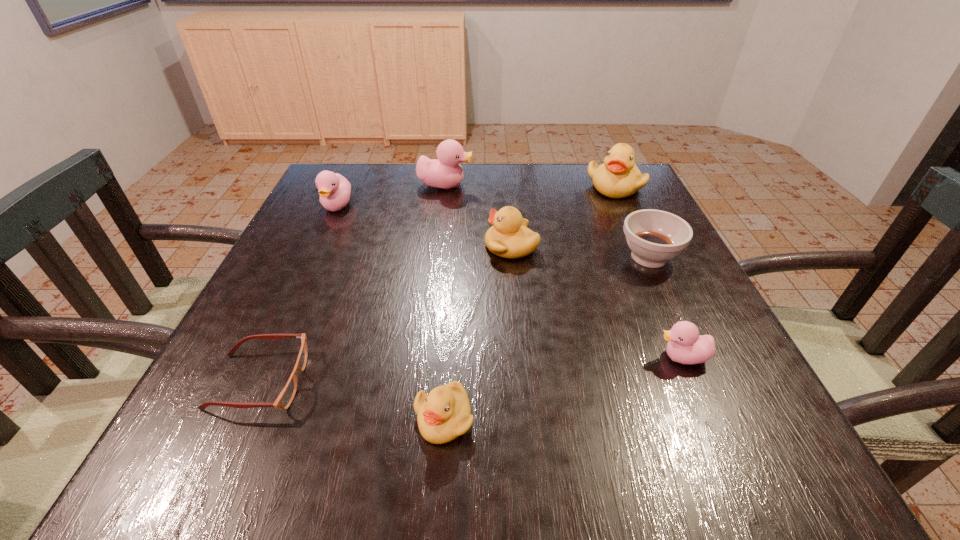
Choose which duckling is the fifth nearest neighbor to the rightmost pink duckling. Please provide its 2D coordinates. Your answer should be formatted as a tuple, i.e. [(x, y)], where the tuple contains the x and y coordinates of a point satisfying the conditions above.

[(334, 189)]

Where is `duckling that is the closest to the biggest pink duckling`? duckling that is the closest to the biggest pink duckling is located at coordinates [x=334, y=189].

Locate an element on the screen. This screenshot has width=960, height=540. pink duckling that stands as the closest to the third duckling from right to left is located at coordinates (445, 172).

In order to click on pink duckling object that ranks as the second closest to the second nearest pink duckling in this screenshot , I will do `click(685, 346)`.

Locate which yellow duckling ranks third in proximity to the second pink duckling from left to right. Please provide its 2D coordinates. Your answer should be formatted as a tuple, i.e. [(x, y)], where the tuple contains the x and y coordinates of a point satisfying the conditions above.

[(444, 414)]

I want to click on yellow duckling that stands as the third closest to the second smallest pink duckling, so click(x=618, y=177).

What are the coordinates of `vacant space that satisfies the following two spatial constraints: 1. on the back side of the soup bowl; 2. on the front-facing side of the second biggest yellow duckling` in the screenshot? It's located at (644, 246).

Image resolution: width=960 pixels, height=540 pixels. I want to click on vacant region that satisfies the following two spatial constraints: 1. on the front-facing side of the biggest pink duckling; 2. on the front-facing side of the leftmost duckling, so click(x=443, y=206).

Where is `vacant region that satisfies the following two spatial constraints: 1. on the front-facing side of the fourth farthest duckling; 2. on the front-facing side of the nearest duckling`? vacant region that satisfies the following two spatial constraints: 1. on the front-facing side of the fourth farthest duckling; 2. on the front-facing side of the nearest duckling is located at coordinates (527, 418).